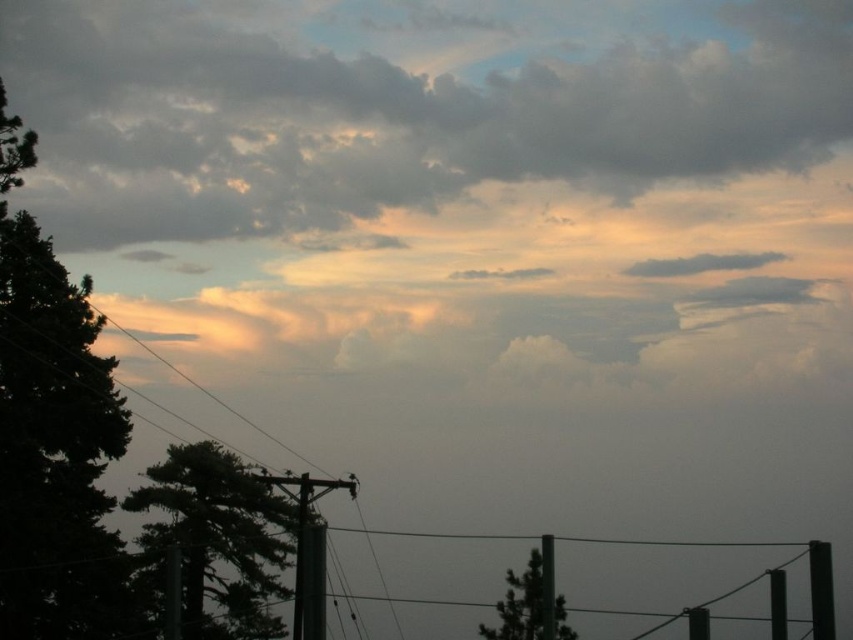
You are standing in the forest looking at the sky scene. There are two points marked in the image. The first point is at coordinates point (814, 636) and the second point is at point (775, 580). Which point is closer to you?

Point (814, 636) is in front of point (775, 580), so it is closer to you.